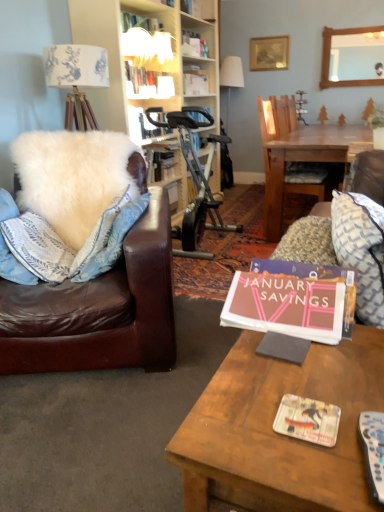
Question: Is white plastic remote control at lower right thinner than matte white book at upper center, which is the 2th book from front to back?

Choices:
 (A) yes
 (B) no

Answer: (B)

Question: From a real-world perspective, is white plastic remote control at lower right on matte white book at upper center, marked as the first book in a back-to-front arrangement?

Choices:
 (A) yes
 (B) no

Answer: (B)

Question: From a real-world perspective, is white plastic remote control at lower right positioned under matte white book at upper center, marked as the first book in a back-to-front arrangement, based on gravity?

Choices:
 (A) no
 (B) yes

Answer: (B)

Question: Is white plastic remote control at lower right directly adjacent to matte white book at upper center, marked as the first book in a back-to-front arrangement?

Choices:
 (A) yes
 (B) no

Answer: (B)

Question: Is white plastic remote control at lower right further to camera compared to matte white book at upper center, arranged as the first book when viewed from the top?

Choices:
 (A) yes
 (B) no

Answer: (B)

Question: From their relative heights in the image, would you say matte pink book at center, the 2th book in the top-to-bottom sequence, is taller or shorter than wooden table at center?

Choices:
 (A) tall
 (B) short

Answer: (B)

Question: Based on their positions, is matte pink book at center, the 2th book in the top-to-bottom sequence, located to the left or right of wooden table at center?

Choices:
 (A) right
 (B) left

Answer: (B)

Question: In the image, is matte pink book at center, the 1th book from the front, positioned in front of or behind wooden table at center?

Choices:
 (A) behind
 (B) front

Answer: (A)

Question: In terms of size, does matte pink book at center, the first book when ordered from bottom to top, appear bigger or smaller than wooden table at center?

Choices:
 (A) big
 (B) small

Answer: (B)

Question: Considering the positions of white fabric lampshade at upper center and wooden mirror at upper center in the image, is white fabric lampshade at upper center taller or shorter than wooden mirror at upper center?

Choices:
 (A) tall
 (B) short

Answer: (A)

Question: Does point (240, 83) appear closer or farther from the camera than point (374, 52)?

Choices:
 (A) closer
 (B) farther

Answer: (B)

Question: Looking at their shapes, would you say white fabric lampshade at upper center is wider or thinner than wooden mirror at upper center?

Choices:
 (A) wide
 (B) thin

Answer: (A)

Question: Considering their positions, is white fabric lampshade at upper center located in front of or behind wooden mirror at upper center?

Choices:
 (A) behind
 (B) front

Answer: (A)

Question: From the image's perspective, is matte white book at upper center, marked as the second book in a right-to-left arrangement, above or below matte paper magazine at center?

Choices:
 (A) above
 (B) below

Answer: (A)

Question: Relative to matte paper magazine at center, is matte white book at upper center, marked as the first book in a back-to-front arrangement, in front or behind?

Choices:
 (A) behind
 (B) front

Answer: (A)